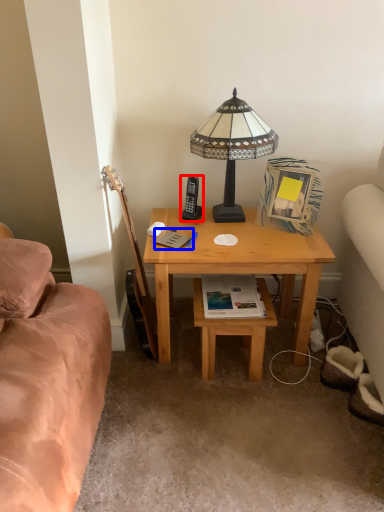
Question: Which object appears closest to the camera in this image, mobile phone (highlighted by a red box) or book (highlighted by a blue box)?

Choices:
 (A) mobile phone
 (B) book

Answer: (B)